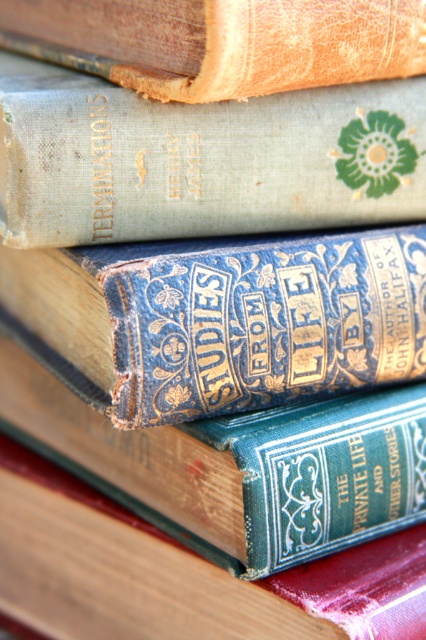
Question: Which point is farther to the camera?

Choices:
 (A) (359, 620)
 (B) (321, 410)
 (C) (150, 298)
 (D) (276, 36)

Answer: (B)

Question: Does blue leather book at center have a lesser width compared to brown leather book at center?

Choices:
 (A) yes
 (B) no

Answer: (A)

Question: Among these points, which one is nearest to the camera?

Choices:
 (A) (167, 227)
 (B) (344, 449)
 (C) (16, 48)

Answer: (B)

Question: Which point is closer to the camera taking this photo?

Choices:
 (A) (423, 332)
 (B) (419, 212)
 (C) (275, 433)
 (D) (169, 4)

Answer: (D)

Question: Can you confirm if blue leather book at center is positioned above brown leather book at center?

Choices:
 (A) yes
 (B) no

Answer: (B)

Question: Where is green leather book at center located in relation to brown leather book at center in the image?

Choices:
 (A) left
 (B) right

Answer: (B)